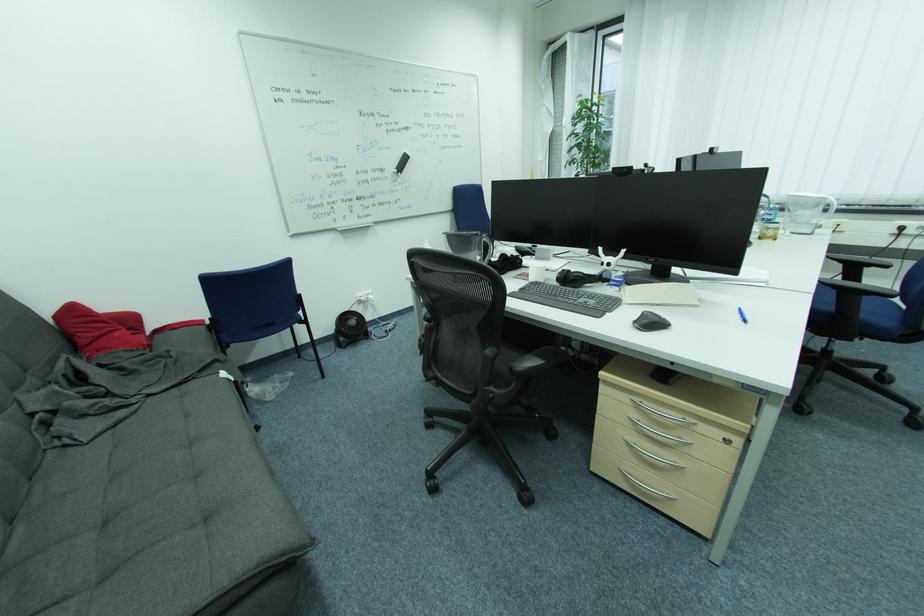
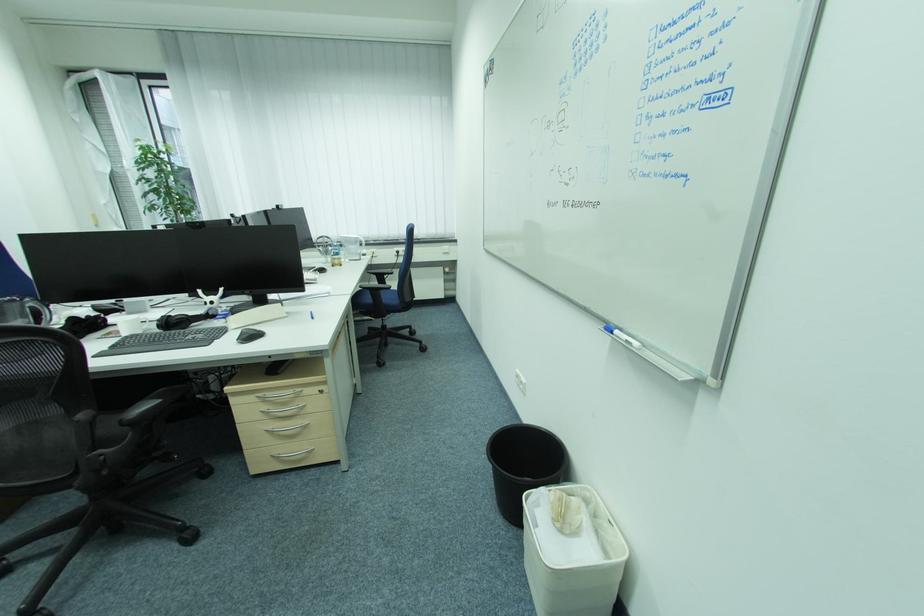
The point at (847,262) is marked in the first image. Where is the corresponding point in the second image?

(381, 275)